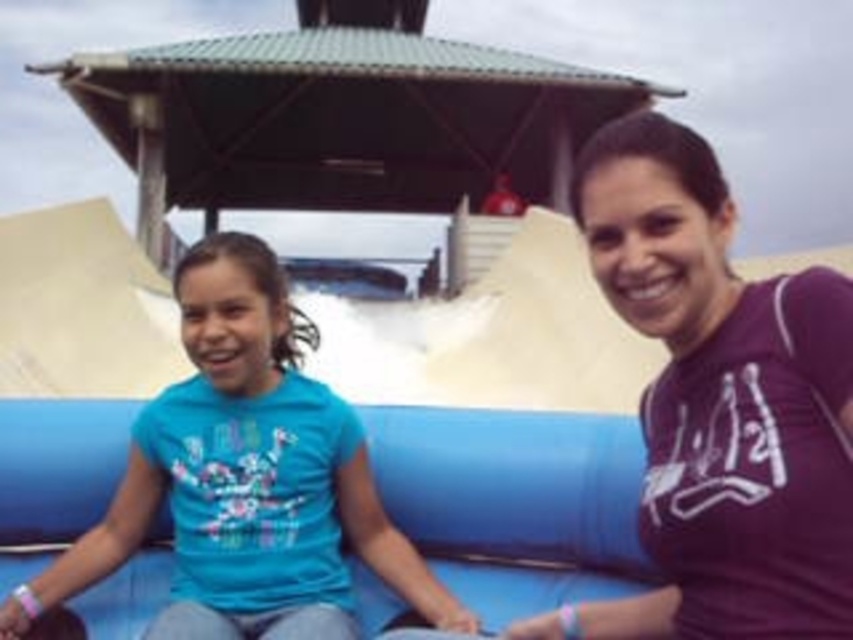
You are standing in front of the blue inflatable slide and see two shirts at the center. Which one is closer to you, the purple matte shirt at center or the blue fabric shirt at center?

The purple matte shirt at center is closer to the viewer than the blue fabric shirt at center according to the description.